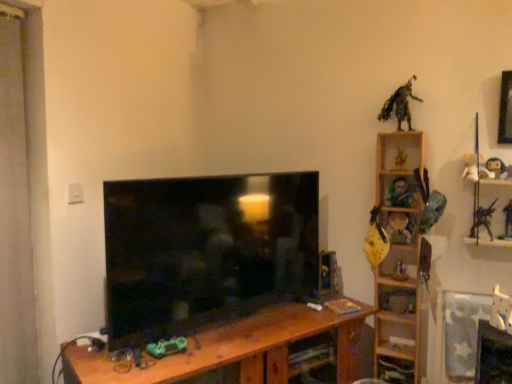
You are a GUI agent. You are given a task and a screenshot of the screen. Output one action in this format:
    pyautogui.click(x=<x>, y=<y>)
    Task: Click on the metallic silver toy at right, which is counted as the 1th toy, starting from the right
    
    Given the screenshot: What is the action you would take?
    pyautogui.click(x=508, y=219)

Where is `matte black action figure at upper right, which is the eleventh toy in left-to-right order`? The image size is (512, 384). matte black action figure at upper right, which is the eleventh toy in left-to-right order is located at coordinates (496, 168).

Where is `matte black tv at center`? Image resolution: width=512 pixels, height=384 pixels. matte black tv at center is located at coordinates (206, 251).

What is the approximate height of white matte figurine at upper right, the eighth toy when ordered from left to right?

white matte figurine at upper right, the eighth toy when ordered from left to right, is 7.00 inches tall.

What do you see at coordinates (234, 349) in the screenshot? I see `brown wood table at center` at bounding box center [234, 349].

The width and height of the screenshot is (512, 384). In order to click on green matte toy car at center, which appears as the 12th toy when viewed from the right in this screenshot , I will do `click(167, 347)`.

Can you confirm if matte black tv at center is taller than yellow matte plush toy at right, the sixth toy in the left-to-right sequence?

Correct, matte black tv at center is much taller as yellow matte plush toy at right, the sixth toy in the left-to-right sequence.

From the picture: Between matte black tv at center and yellow matte plush toy at right, which appears as the 7th toy when viewed from the right, which one has smaller size?

With smaller size is yellow matte plush toy at right, which appears as the 7th toy when viewed from the right.

Is matte black tv at center not near yellow matte plush toy at right, the sixth toy in the left-to-right sequence?

No, matte black tv at center is not far away from yellow matte plush toy at right, the sixth toy in the left-to-right sequence.

Is matte black tv at center further to camera compared to yellow matte plush toy at right, which appears as the 7th toy when viewed from the right?

No, matte black tv at center is in front of yellow matte plush toy at right, which appears as the 7th toy when viewed from the right.

From the picture: Does green metallic figure at upper right, which appears as the third toy when viewed from the left, have a larger size compared to wooden at right?

No.

Based on their positions, is green metallic figure at upper right, marked as the 10th toy in a right-to-left arrangement, located to the left or right of wooden at right?

green metallic figure at upper right, marked as the 10th toy in a right-to-left arrangement, is positioned on wooden at right's left side.

Is point (407, 81) closer or farther from the camera than point (420, 309)?

Point (407, 81).

Considering the sizes of yellow matte plush toy at right, the sixth toy in the left-to-right sequence, and matte black tv at center in the image, is yellow matte plush toy at right, the sixth toy in the left-to-right sequence, taller or shorter than matte black tv at center?

Considering their sizes, yellow matte plush toy at right, the sixth toy in the left-to-right sequence, has less height than matte black tv at center.

Which of these two, yellow matte plush toy at right, which appears as the 7th toy when viewed from the right, or matte black tv at center, is wider?

Wider between the two is matte black tv at center.

Is matte black tv at center at the back of yellow matte plush toy at right, the sixth toy in the left-to-right sequence?

yellow matte plush toy at right, the sixth toy in the left-to-right sequence, does not have its back to matte black tv at center.

Is yellow matte plush toy at right, the sixth toy in the left-to-right sequence, situated inside matte black tv at center or outside?

yellow matte plush toy at right, the sixth toy in the left-to-right sequence, is spatially situated outside matte black tv at center.

Which is more to the left, yellow matte plush toy at right, which appears as the 7th toy when viewed from the right, or yellow matte guitar at right, the 11th toy from the right?

yellow matte guitar at right, the 11th toy from the right, is more to the left.

Is yellow matte plush toy at right, which appears as the 7th toy when viewed from the right, oriented away from yellow matte guitar at right, positioned as the 2th toy in left-to-right order?

No.

Is yellow matte plush toy at right, which appears as the 7th toy when viewed from the right, directly adjacent to yellow matte guitar at right, the 11th toy from the right?

Indeed, yellow matte plush toy at right, which appears as the 7th toy when viewed from the right, and yellow matte guitar at right, the 11th toy from the right, are beside each other and touching.

Is white matte figurine at upper right, which appears as the fifth toy when viewed from the right, located outside green matte toy car at center, which is the 1th toy from left to right?

Yes.

From the picture: From a real-world perspective, which is physically below, white matte figurine at upper right, the eighth toy when ordered from left to right, or green matte toy car at center, which is the 1th toy from left to right?

green matte toy car at center, which is the 1th toy from left to right, from a real-world perspective.

From the image's perspective, starting from the white matte figurine at upper right, the eighth toy when ordered from left to right, which toy is the 9th one below? Please provide its 2D coordinates.

[(167, 347)]

Who is smaller, wooden guitar at upper right, acting as the sixth toy starting from the right, or metallic silver toy at right, the twelfth toy positioned from the left?

metallic silver toy at right, the twelfth toy positioned from the left.

Based on the photo, which object is positioned more to the left, wooden guitar at upper right, acting as the sixth toy starting from the right, or metallic silver toy at right, which is counted as the 1th toy, starting from the right?

wooden guitar at upper right, acting as the sixth toy starting from the right.

In the scene shown: From a real-world perspective, is wooden guitar at upper right, acting as the sixth toy starting from the right, physically above metallic silver toy at right, which is counted as the 1th toy, starting from the right?

Yes.

Is wooden guitar at upper right, acting as the sixth toy starting from the right, beside metallic silver toy at right, which is counted as the 1th toy, starting from the right?

They are not placed beside each other.

Is yellow matte plush toy at right, the sixth toy in the left-to-right sequence, in front of or behind yellow matte guitar at upper right, the ninth toy from the right, in the image?

yellow matte plush toy at right, the sixth toy in the left-to-right sequence, is behind yellow matte guitar at upper right, the ninth toy from the right.

In terms of width, does yellow matte plush toy at right, which appears as the 7th toy when viewed from the right, look wider or thinner when compared to yellow matte guitar at upper right, the ninth toy from the right?

Considering their sizes, yellow matte plush toy at right, which appears as the 7th toy when viewed from the right, looks slimmer than yellow matte guitar at upper right, the ninth toy from the right.

Considering the relative positions of yellow matte plush toy at right, which appears as the 7th toy when viewed from the right, and yellow matte guitar at upper right, the ninth toy from the right, in the image provided, is yellow matte plush toy at right, which appears as the 7th toy when viewed from the right, to the right of yellow matte guitar at upper right, the ninth toy from the right, from the viewer's perspective?

Correct, you'll find yellow matte plush toy at right, which appears as the 7th toy when viewed from the right, to the right of yellow matte guitar at upper right, the ninth toy from the right.

From the image's perspective, would you say yellow matte plush toy at right, the sixth toy in the left-to-right sequence, is shown under yellow matte guitar at upper right, the 4th toy from the left?

Yes, from the image's perspective, yellow matte plush toy at right, the sixth toy in the left-to-right sequence, is beneath yellow matte guitar at upper right, the 4th toy from the left.

You are a GUI agent. You are given a task and a screenshot of the screen. Output one action in this format:
    pyautogui.click(x=<x>, y=<y>)
    Task: Click on the television in front of the yellow matte plush toy at right, the sixth toy in the left-to-right sequence
    The height and width of the screenshot is (384, 512).
    Given the screenshot: What is the action you would take?
    pyautogui.click(x=206, y=251)

From the image's perspective, count 10th toys upward from the wooden at right and point to it. Please provide its 2D coordinates.

[(399, 104)]

When comparing their distances from yellow matte guitar at upper right, the 4th toy from the left, does plush white doll at upper right, placed as the tenth toy when sorted from left to right, or yellow matte guitar at right, the 11th toy from the right, seem closer?

yellow matte guitar at right, the 11th toy from the right, lies closer to yellow matte guitar at upper right, the 4th toy from the left, than the other object.

Estimate the real-world distances between objects in this image. Which object is closer to brown wood table at center, yellow matte guitar at upper right, the 4th toy from the left, or plush white doll at upper right, placed as the tenth toy when sorted from left to right?

Among the two, plush white doll at upper right, placed as the tenth toy when sorted from left to right, is located nearer to brown wood table at center.

From the image, which object appears to be nearer to wooden at right, metallic silver toy at right, the twelfth toy positioned from the left, or metallic silver toy at upper right, positioned as the 4th toy in right-to-left order?

metallic silver toy at upper right, positioned as the 4th toy in right-to-left order, is closer to wooden at right.

Which object lies nearer to the anchor point metallic silver toy at right, which is counted as the 1th toy, starting from the right, matte yellow toy at right, the 8th toy viewed from the right, or yellow matte guitar at upper right, the 4th toy from the left?

matte yellow toy at right, the 8th toy viewed from the right, is closer to metallic silver toy at right, which is counted as the 1th toy, starting from the right.

Considering their positions, is wooden at right positioned closer to green matte toy car at center, which appears as the 12th toy when viewed from the right, than green metallic figure at upper right, marked as the 10th toy in a right-to-left arrangement?

Based on the image, wooden at right appears to be nearer to green matte toy car at center, which appears as the 12th toy when viewed from the right.

Which object lies further to the anchor point wooden at right, yellow matte guitar at upper right, the ninth toy from the right, or green metallic figure at upper right, which appears as the third toy when viewed from the left?

green metallic figure at upper right, which appears as the third toy when viewed from the left, is positioned further to the anchor wooden at right.

Which object lies further to the anchor point wooden guitar at upper right, which ranks as the 7th toy in left-to-right order, green matte toy car at center, which is the 1th toy from left to right, or yellow matte plush toy at right, the sixth toy in the left-to-right sequence?

green matte toy car at center, which is the 1th toy from left to right, is positioned further to the anchor wooden guitar at upper right, which ranks as the 7th toy in left-to-right order.

Considering their positions, is brown wood table at center positioned further to green matte toy car at center, which is the 1th toy from left to right, than yellow matte plush toy at right, which appears as the 7th toy when viewed from the right?

Among the two, yellow matte plush toy at right, which appears as the 7th toy when viewed from the right, is located further to green matte toy car at center, which is the 1th toy from left to right.

At what (x,y) coordinates should I click in order to perform the action: click on table located between green matte toy car at center, which is the 1th toy from left to right, and yellow matte guitar at right, positioned as the 2th toy in left-to-right order, in the left-right direction. Please return your answer as a coordinate pair (x, y). This screenshot has height=384, width=512. Looking at the image, I should click on (234, 349).

Locate an element on the screen. This screenshot has width=512, height=384. shelf between green matte toy car at center, which appears as the 12th toy when viewed from the right, and matte yellow toy at right, which is counted as the fifth toy, starting from the left is located at coordinates (400, 258).

Locate an element on the screen. shelf situated between matte black tv at center and white matte figurine at upper right, which appears as the fifth toy when viewed from the right, from left to right is located at coordinates (400, 258).

The height and width of the screenshot is (384, 512). I want to click on toy between yellow matte plush toy at right, the sixth toy in the left-to-right sequence, and white matte figurine at upper right, which appears as the fifth toy when viewed from the right, so click(x=400, y=193).